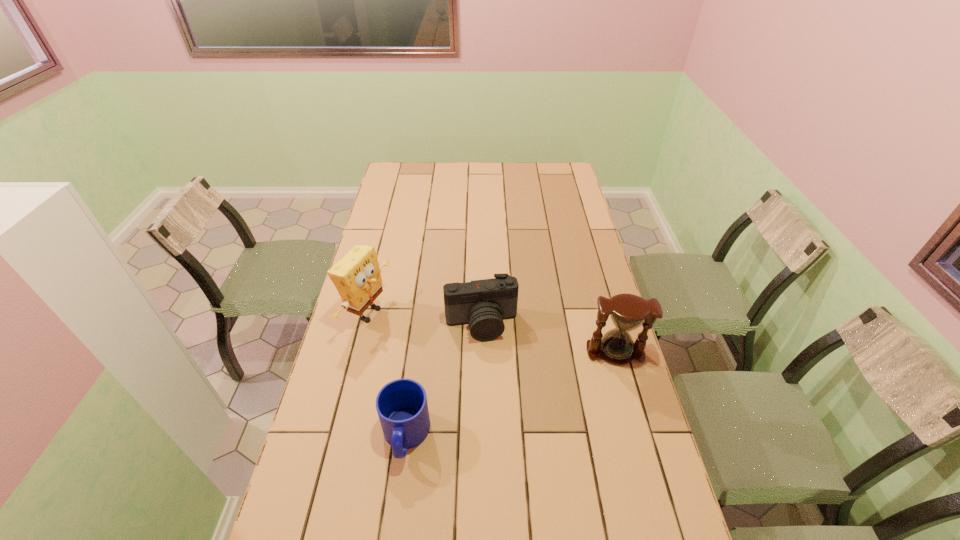
You are a GUI agent. You are given a task and a screenshot of the screen. Output one action in this format:
    pyautogui.click(x=<x>, y=<y>)
    Task: Click on the free spot between the mug and the rightmost object
    The width and height of the screenshot is (960, 540).
    Given the screenshot: What is the action you would take?
    pyautogui.click(x=511, y=394)

The image size is (960, 540). In order to click on vacant space in between the rightmost object and the third object from right to left in this screenshot , I will do [511, 394].

What are the coordinates of `vacant space that's between the nearest object and the hourglass` in the screenshot? It's located at (511, 394).

Image resolution: width=960 pixels, height=540 pixels. Find the location of `vacant area that lies between the rightmost object and the camera`. vacant area that lies between the rightmost object and the camera is located at coordinates (548, 339).

What are the coordinates of `vacant space that is in between the nearest object and the rightmost object` in the screenshot? It's located at (511, 394).

Find the location of a particular element. The width and height of the screenshot is (960, 540). free space between the third tallest object and the nearest object is located at coordinates (444, 380).

This screenshot has width=960, height=540. Identify the location of vacant space in between the sponge and the third object from right to left. (387, 375).

Where is `unoccupied position between the second object from left to right and the second object from right to left`? unoccupied position between the second object from left to right and the second object from right to left is located at coordinates (444, 380).

Identify the location of free space that is in between the nearest object and the camera. (444, 380).

Select which object appears as the third closest to the shortest object. Please provide its 2D coordinates. Your answer should be formatted as a tuple, i.e. [(x, y)], where the tuple contains the x and y coordinates of a point satisfying the conditions above.

[(628, 312)]